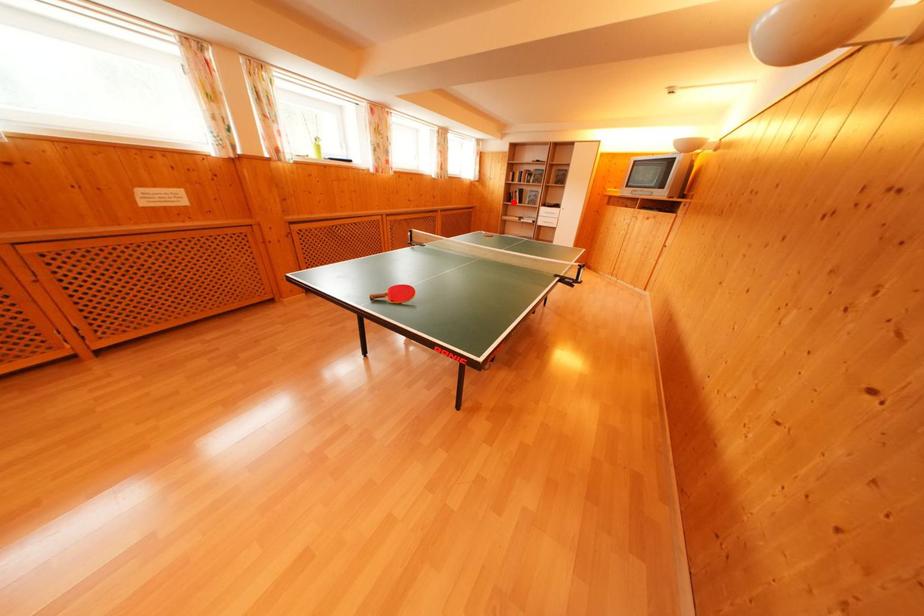
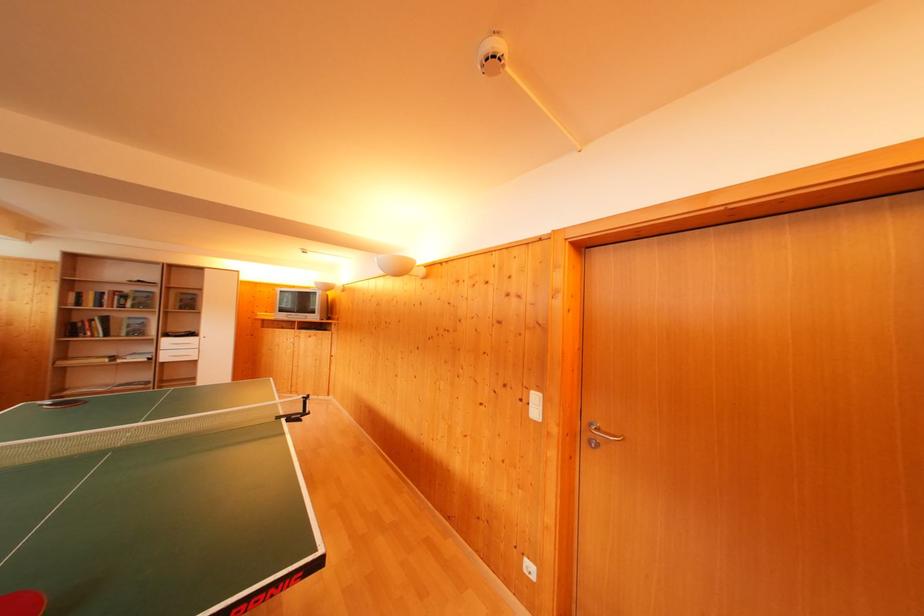
Question: I am providing you with two images of the same scene from different viewpoints. Given a red point in image1, look at the same physical point in image2. Is it:

Choices:
 (A) Closer to the viewpoint
 (B) Farther from the viewpoint

Answer: (B)